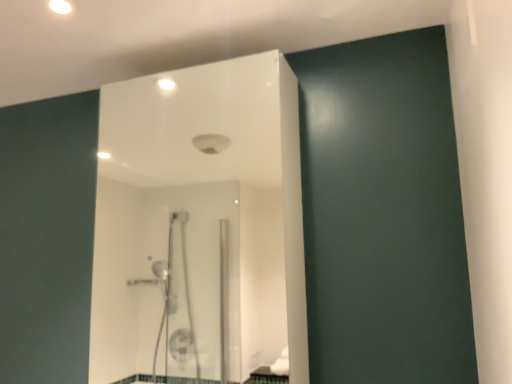
Image resolution: width=512 pixels, height=384 pixels. What do you see at coordinates (200, 224) in the screenshot?
I see `glossy white shower at upper center` at bounding box center [200, 224].

Locate an element on the screen. This screenshot has height=384, width=512. glossy white shower at upper center is located at coordinates (200, 224).

Identify the location of glossy white shower at upper center. This screenshot has width=512, height=384. (200, 224).